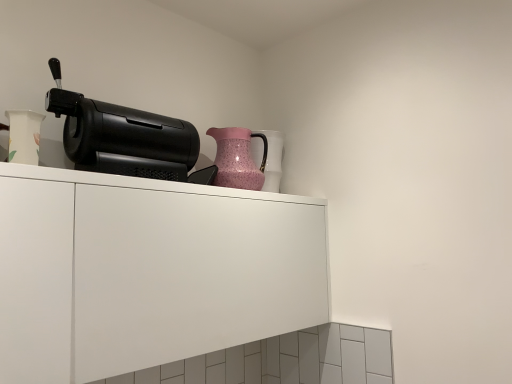
Find the location of a particular element. Image resolution: width=512 pixels, height=384 pixels. white glossy vase at left, the 2th vase positioned from the right is located at coordinates click(x=24, y=136).

Where is `white matte cabinet at upper center`? Image resolution: width=512 pixels, height=384 pixels. white matte cabinet at upper center is located at coordinates (147, 271).

In order to face pink speckled glass jug at upper right, should I rotate leftwards or rightwards?

You should look left and rotate roughly 2.030 degrees.

Describe the element at coordinates (122, 137) in the screenshot. This screenshot has width=512, height=384. I see `black plastic coffee machine at upper left` at that location.

Identify the location of white glossy vase at left, the 2th vase positioned from the right. This screenshot has height=384, width=512. (24, 136).

Does point (121, 373) lie in front of point (34, 155)?

Yes.

Which is in front, white matte cabinet at upper center or white glossy vase at left, the 2th vase positioned from the right?

white matte cabinet at upper center is in front.

Does white matte cabinet at upper center have a lesser width compared to white glossy vase at left, the 2th vase positioned from the right?

No, white matte cabinet at upper center is not thinner than white glossy vase at left, the 2th vase positioned from the right.

How much distance is there between white matte cabinet at upper center and white glossy vase at left, the first vase in the left-to-right sequence?

white matte cabinet at upper center and white glossy vase at left, the first vase in the left-to-right sequence, are 17.90 inches apart from each other.

Is white glossy vase at left, the 2th vase positioned from the right, positioned with its back to pink textured vase at upper center, positioned as the second vase in front-to-back order?

That's not correct — white glossy vase at left, the 2th vase positioned from the right, is not looking away from pink textured vase at upper center, positioned as the second vase in front-to-back order.

Would you consider white glossy vase at left, the 2th vase positioned from the right, to be distant from pink textured vase at upper center, acting as the first vase starting from the back?

No, there isn't a large distance between white glossy vase at left, the 2th vase positioned from the right, and pink textured vase at upper center, acting as the first vase starting from the back.

Considering the relative sizes of white glossy vase at left, the first vase in the left-to-right sequence, and pink textured vase at upper center, positioned as the second vase in front-to-back order, in the image provided, is white glossy vase at left, the first vase in the left-to-right sequence, taller than pink textured vase at upper center, positioned as the second vase in front-to-back order,?

Incorrect, the height of white glossy vase at left, the first vase in the left-to-right sequence, is not larger of that of pink textured vase at upper center, positioned as the second vase in front-to-back order.

Can you confirm if white glossy vase at left, which is counted as the second vase, starting from the back, is bigger than pink textured vase at upper center, placed as the 2th vase when sorted from left to right?

Actually, white glossy vase at left, which is counted as the second vase, starting from the back, might be smaller than pink textured vase at upper center, placed as the 2th vase when sorted from left to right.

Measure the distance between pink textured vase at upper center, positioned as the second vase in front-to-back order, and pink speckled glass jug at upper right.

The distance of pink textured vase at upper center, positioned as the second vase in front-to-back order, from pink speckled glass jug at upper right is 3.34 inches.

Do you think pink textured vase at upper center, placed as the 2th vase when sorted from left to right, is within pink speckled glass jug at upper right, or outside of it?

pink textured vase at upper center, placed as the 2th vase when sorted from left to right, is spatially situated outside pink speckled glass jug at upper right.

Which is in front, point (270, 141) or point (221, 173)?

The point (221, 173) is more forward.

Considering the relative sizes of pink textured vase at upper center, placed as the 1th vase when sorted from right to left, and pink speckled glass jug at upper right in the image provided, is pink textured vase at upper center, placed as the 1th vase when sorted from right to left, shorter than pink speckled glass jug at upper right?

No.

In the scene shown: From the image's perspective, which is above, pink textured vase at upper center, positioned as the second vase in front-to-back order, or white matte cabinet at upper center?

pink textured vase at upper center, positioned as the second vase in front-to-back order, from the image's perspective.

Is point (270, 181) behind point (135, 198)?

Yes, point (270, 181) is behind point (135, 198).

In the image, there is a pink textured vase at upper center, placed as the 1th vase when sorted from right to left. Where is `cabinetry below it (from a real-world perspective)`? cabinetry below it (from a real-world perspective) is located at coordinates (147, 271).

Is pink textured vase at upper center, placed as the 2th vase when sorted from left to right, aimed at white matte cabinet at upper center?

No, pink textured vase at upper center, placed as the 2th vase when sorted from left to right, is not aimed at white matte cabinet at upper center.

Based on the photo, between white matte cabinet at upper center and pink textured vase at upper center, positioned as the second vase in front-to-back order, which one is positioned in front?

white matte cabinet at upper center is closer to the camera.

From a real-world perspective, which object stands above the other?

pink textured vase at upper center, placed as the 1th vase when sorted from right to left, from a real-world perspective.

Is white matte cabinet at upper center thinner than pink textured vase at upper center, acting as the first vase starting from the back?

In fact, white matte cabinet at upper center might be wider than pink textured vase at upper center, acting as the first vase starting from the back.

From their relative heights in the image, would you say pink speckled glass jug at upper right is taller or shorter than black plastic coffee machine at upper left?

In the image, pink speckled glass jug at upper right appears to be taller than black plastic coffee machine at upper left.

From the image's perspective, is pink speckled glass jug at upper right located above or below black plastic coffee machine at upper left?

Based on their image positions, pink speckled glass jug at upper right is located beneath black plastic coffee machine at upper left.

Does pink speckled glass jug at upper right appear on the left side of black plastic coffee machine at upper left?

In fact, pink speckled glass jug at upper right is to the right of black plastic coffee machine at upper left.

From a real-world perspective, is pink speckled glass jug at upper right physically below black plastic coffee machine at upper left?

Yes, from a real-world perspective, pink speckled glass jug at upper right is beneath black plastic coffee machine at upper left.

From the image's perspective, which one is positioned lower, black plastic coffee machine at upper left or white matte cabinet at upper center?

white matte cabinet at upper center appears lower in the image.

Can you confirm if black plastic coffee machine at upper left is thinner than white matte cabinet at upper center?

Correct, the width of black plastic coffee machine at upper left is less than that of white matte cabinet at upper center.

Considering the sizes of black plastic coffee machine at upper left and white matte cabinet at upper center in the image, is black plastic coffee machine at upper left bigger or smaller than white matte cabinet at upper center?

In the image, black plastic coffee machine at upper left appears to be smaller than white matte cabinet at upper center.

Is black plastic coffee machine at upper left shorter than white matte cabinet at upper center?

Correct, black plastic coffee machine at upper left is not as tall as white matte cabinet at upper center.

I want to click on vase on the left of white matte cabinet at upper center, so click(x=24, y=136).

Find the location of `vase lying below the pink textured vase at upper center, placed as the 1th vase when sorted from right to left (from the image's perspective)`. vase lying below the pink textured vase at upper center, placed as the 1th vase when sorted from right to left (from the image's perspective) is located at coordinates (24, 136).

Which object lies nearer to the anchor point white matte cabinet at upper center, pink textured vase at upper center, placed as the 2th vase when sorted from left to right, or black plastic coffee machine at upper left?

black plastic coffee machine at upper left is closer to white matte cabinet at upper center.

Which object lies further to the anchor point white matte cabinet at upper center, white glossy vase at left, the 2th vase positioned from the right, or pink textured vase at upper center, placed as the 2th vase when sorted from left to right?

pink textured vase at upper center, placed as the 2th vase when sorted from left to right, lies further to white matte cabinet at upper center than the other object.

From the picture: Considering their positions, is pink textured vase at upper center, placed as the 2th vase when sorted from left to right, positioned further to pink speckled glass jug at upper right than white glossy vase at left, which is counted as the second vase, starting from the back?

white glossy vase at left, which is counted as the second vase, starting from the back.

Which object lies nearer to the anchor point white glossy vase at left, which is the first vase in front-to-back order, black plastic coffee machine at upper left or white matte cabinet at upper center?

Based on the image, black plastic coffee machine at upper left appears to be nearer to white glossy vase at left, which is the first vase in front-to-back order.

Estimate the real-world distances between objects in this image. Which object is further from pink textured vase at upper center, positioned as the second vase in front-to-back order, black plastic coffee machine at upper left or white matte cabinet at upper center?

white matte cabinet at upper center is positioned further to the anchor pink textured vase at upper center, positioned as the second vase in front-to-back order.

Considering their positions, is white glossy vase at left, the first vase in the left-to-right sequence, positioned closer to pink textured vase at upper center, placed as the 1th vase when sorted from right to left, than pink speckled glass jug at upper right?

Based on the image, pink speckled glass jug at upper right appears to be nearer to pink textured vase at upper center, placed as the 1th vase when sorted from right to left.

Considering their positions, is white glossy vase at left, which is the first vase in front-to-back order, positioned further to black plastic coffee machine at upper left than pink textured vase at upper center, placed as the 1th vase when sorted from right to left?

pink textured vase at upper center, placed as the 1th vase when sorted from right to left, is further to black plastic coffee machine at upper left.

Looking at the image, which one is located further to white matte cabinet at upper center, black plastic coffee machine at upper left or pink speckled glass jug at upper right?

pink speckled glass jug at upper right lies further to white matte cabinet at upper center than the other object.

The height and width of the screenshot is (384, 512). I want to click on jug between white glossy vase at left, the 2th vase positioned from the right, and pink textured vase at upper center, placed as the 2th vase when sorted from left to right, so click(237, 158).

Locate an element on the screen. vase between white matte cabinet at upper center and pink speckled glass jug at upper right from front to back is located at coordinates point(24,136).

You are a GUI agent. You are given a task and a screenshot of the screen. Output one action in this format:
    pyautogui.click(x=<x>, y=<y>)
    Task: Click on the jug between white matte cabinet at upper center and pink textured vase at upper center, acting as the first vase starting from the back, along the z-axis
    
    Given the screenshot: What is the action you would take?
    pyautogui.click(x=237, y=158)

Where is `home appliance between white matte cabinet at upper center and pink speckled glass jug at upper right along the z-axis`? This screenshot has width=512, height=384. home appliance between white matte cabinet at upper center and pink speckled glass jug at upper right along the z-axis is located at coordinates (122, 137).